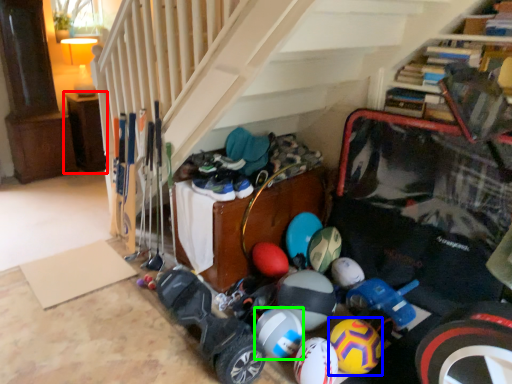
Question: Considering the real-world distances, which object is closest to furniture (highlighted by a red box)? bowling ball (highlighted by a blue box) or bowling ball (highlighted by a green box).

Choices:
 (A) bowling ball
 (B) bowling ball

Answer: (B)